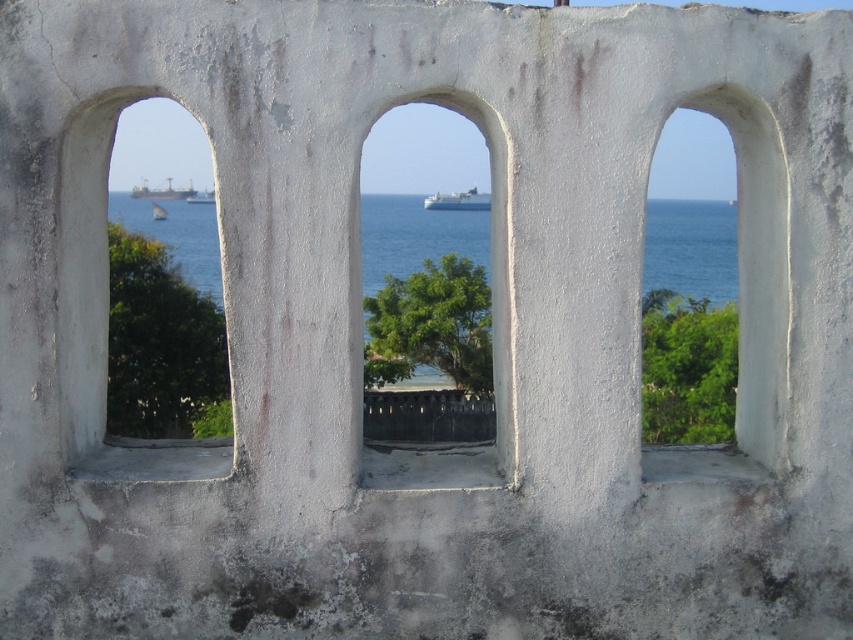
Question: Which point is closer to the camera?

Choices:
 (A) white concrete arch at left
 (B) metallic gray ship at left

Answer: (A)

Question: Is blue water at center wider than white concrete arch at center?

Choices:
 (A) no
 (B) yes

Answer: (B)

Question: Which is nearer to the blue water at center?

Choices:
 (A) metallic gray ship at left
 (B) white matte ship at center

Answer: (B)

Question: Does blue water at center appear over white matte ship at center?

Choices:
 (A) yes
 (B) no

Answer: (B)

Question: Can you confirm if blue water at center is smaller than white concrete arch at center?

Choices:
 (A) no
 (B) yes

Answer: (A)

Question: Estimate the real-world distances between objects in this image. Which object is closer to the white concrete arch at center?

Choices:
 (A) white concrete arch at left
 (B) metallic gray ship at left

Answer: (A)